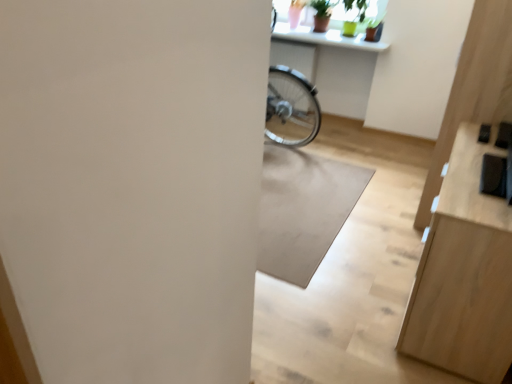
What do you see at coordinates (464, 274) in the screenshot? The image size is (512, 384). I see `light wood dresser at right` at bounding box center [464, 274].

At what (x,y) coordinates should I click in order to perform the action: click on light wood dresser at right. Please return your answer as a coordinate pair (x, y). Looking at the image, I should click on coord(464,274).

Where is `white glossy counter top at upper center`? This screenshot has height=384, width=512. white glossy counter top at upper center is located at coordinates (326, 38).

The height and width of the screenshot is (384, 512). Identify the location of light wood dresser at right. point(464,274).

Measure the distance from light wood dresser at right to white matte mat at center.

The distance of light wood dresser at right from white matte mat at center is 35.52 inches.

From a real-world perspective, between light wood dresser at right and white matte mat at center, who is vertically higher?

In real-world perspective, light wood dresser at right is above.

Could you tell me if light wood dresser at right is facing white matte mat at center?

Yes, light wood dresser at right is facing white matte mat at center.

From the image's perspective, which one is positioned lower, light wood dresser at right or white matte mat at center?

light wood dresser at right appears lower in the image.

Where is `dresser that appears below the white glossy counter top at upper center (from the image's perspective)`? This screenshot has height=384, width=512. dresser that appears below the white glossy counter top at upper center (from the image's perspective) is located at coordinates (464, 274).

Who is bigger, white glossy counter top at upper center or light wood dresser at right?

Bigger between the two is light wood dresser at right.

Based on the photo, from the image's perspective, is white glossy counter top at upper center below light wood dresser at right?

Actually, white glossy counter top at upper center appears above light wood dresser at right in the image.

Between white matte mat at center and white glossy counter top at upper center, which one has more height?

With more height is white glossy counter top at upper center.

Can you tell me how much white matte mat at center and white glossy counter top at upper center differ in facing direction?

white matte mat at center and white glossy counter top at upper center are facing 1.15 degrees away from each other.

How much distance is there between white matte mat at center and white glossy counter top at upper center?

white matte mat at center and white glossy counter top at upper center are 4.57 feet apart.

Can you confirm if white matte mat at center is thinner than white glossy counter top at upper center?

Incorrect, the width of white matte mat at center is not less than that of white glossy counter top at upper center.

Which is in front, point (330, 225) or point (502, 264)?

The point (502, 264) is in front.

In order to click on dresser on the right of white matte mat at center in this screenshot , I will do `click(464, 274)`.

How many degrees apart are the facing directions of white matte mat at center and light wood dresser at right?

They differ by 88.8 degrees in their facing directions.

Which of these two, white matte mat at center or light wood dresser at right, is wider?

With larger width is white matte mat at center.

From a real-world perspective, which object stands above the other?

In real-world perspective, white glossy counter top at upper center is above.

Considering the positions of points (454, 159) and (341, 45), is point (454, 159) closer to camera compared to point (341, 45)?

Yes, point (454, 159) is in front of point (341, 45).

Considering their positions, is light wood dresser at right located in front of or behind white glossy counter top at upper center?

Clearly, light wood dresser at right is in front of white glossy counter top at upper center.

Does light wood dresser at right touch white glossy counter top at upper center?

light wood dresser at right is not next to white glossy counter top at upper center, and they're not touching.

Is white glossy counter top at upper center in front of white matte mat at center?

No, the depth of white glossy counter top at upper center is greater than that of white matte mat at center.

Does white glossy counter top at upper center touch white matte mat at center?

No, white glossy counter top at upper center is not making contact with white matte mat at center.

From a real-world perspective, is white glossy counter top at upper center on white matte mat at center?

Yes, from a real-world perspective, white glossy counter top at upper center is on top of white matte mat at center.

From the image's perspective, which object appears higher, white glossy counter top at upper center or white matte mat at center?

white glossy counter top at upper center is shown above in the image.

Where is `mat located underneath the light wood dresser at right (from a real-world perspective)`? The image size is (512, 384). mat located underneath the light wood dresser at right (from a real-world perspective) is located at coordinates (303, 210).

This screenshot has width=512, height=384. In the image, there is a light wood dresser at right. In order to click on counter top above it (from the image's perspective) in this screenshot , I will do `click(326, 38)`.

Estimate the real-world distances between objects in this image. Which object is closer to white glossy counter top at upper center, light wood dresser at right or white matte mat at center?

Based on the image, white matte mat at center appears to be nearer to white glossy counter top at upper center.

Looking at the image, which one is located closer to white matte mat at center, white glossy counter top at upper center or light wood dresser at right?

Based on the image, light wood dresser at right appears to be nearer to white matte mat at center.

Based on their spatial positions, is white matte mat at center or light wood dresser at right closer to white glossy counter top at upper center?

white matte mat at center is closer to white glossy counter top at upper center.

Estimate the real-world distances between objects in this image. Which object is further from light wood dresser at right, white glossy counter top at upper center or white matte mat at center?

white glossy counter top at upper center lies further to light wood dresser at right than the other object.

Based on their spatial positions, is white matte mat at center or white glossy counter top at upper center further from light wood dresser at right?

Among the two, white glossy counter top at upper center is located further to light wood dresser at right.

From the image, which object appears to be nearer to white matte mat at center, light wood dresser at right or white glossy counter top at upper center?

light wood dresser at right.

Find the location of a particular element. This screenshot has height=384, width=512. mat between light wood dresser at right and white glossy counter top at upper center from front to back is located at coordinates (303, 210).